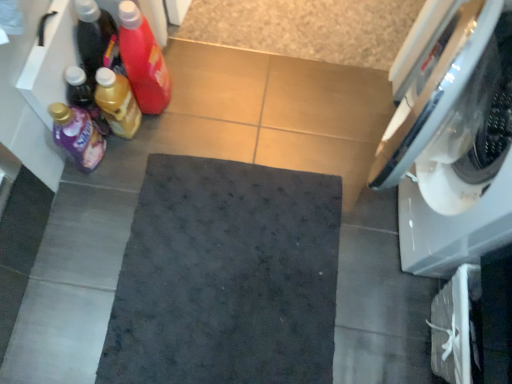
Question: From the image's perspective, is dark matte bath mat at center beneath translucent plastic bottle at left, the 3th bottle when ordered from right to left?

Choices:
 (A) yes
 (B) no

Answer: (A)

Question: Is dark matte bath mat at center located outside translucent plastic bottle at left, the 2th bottle from the left?

Choices:
 (A) yes
 (B) no

Answer: (A)

Question: Is dark matte bath mat at center positioned with its back to translucent plastic bottle at left, the 2th bottle from the left?

Choices:
 (A) no
 (B) yes

Answer: (A)

Question: Considering the relative sizes of dark matte bath mat at center and translucent plastic bottle at left, the 2th bottle from the left, in the image provided, is dark matte bath mat at center shorter than translucent plastic bottle at left, the 2th bottle from the left,?

Choices:
 (A) no
 (B) yes

Answer: (B)

Question: Is dark matte bath mat at center aimed at translucent plastic bottle at left, the 3th bottle when ordered from right to left?

Choices:
 (A) yes
 (B) no

Answer: (B)

Question: From a real-world perspective, is dark matte bath mat at center located beneath translucent plastic bottle at left, the 2th bottle from the left?

Choices:
 (A) yes
 (B) no

Answer: (A)

Question: Is dark matte bath mat at center placed right next to translucent plastic bottle at left, positioned as the 1th bottle in right-to-left order?

Choices:
 (A) no
 (B) yes

Answer: (A)

Question: Does dark matte bath mat at center come behind translucent plastic bottle at left, marked as the fourth bottle in a left-to-right arrangement?

Choices:
 (A) yes
 (B) no

Answer: (A)

Question: Is dark matte bath mat at center far from translucent plastic bottle at left, marked as the fourth bottle in a left-to-right arrangement?

Choices:
 (A) yes
 (B) no

Answer: (B)

Question: Considering the relative sizes of dark matte bath mat at center and translucent plastic bottle at left, marked as the fourth bottle in a left-to-right arrangement, in the image provided, is dark matte bath mat at center smaller than translucent plastic bottle at left, marked as the fourth bottle in a left-to-right arrangement,?

Choices:
 (A) no
 (B) yes

Answer: (A)

Question: Could you tell me if dark matte bath mat at center is turned towards translucent plastic bottle at left, marked as the fourth bottle in a left-to-right arrangement?

Choices:
 (A) no
 (B) yes

Answer: (A)

Question: Considering the relative sizes of dark matte bath mat at center and translucent plastic bottle at left, marked as the fourth bottle in a left-to-right arrangement, in the image provided, is dark matte bath mat at center thinner than translucent plastic bottle at left, marked as the fourth bottle in a left-to-right arrangement,?

Choices:
 (A) yes
 (B) no

Answer: (B)

Question: Can we say white glossy washing machine at right lies outside translucent plastic bottle at left, the third bottle when ordered from left to right?

Choices:
 (A) no
 (B) yes

Answer: (B)